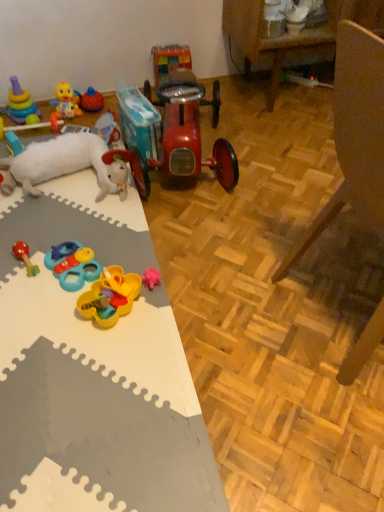
Identify the location of free area in between wooden armchair at lower right and white foam mat at left. (242, 295).